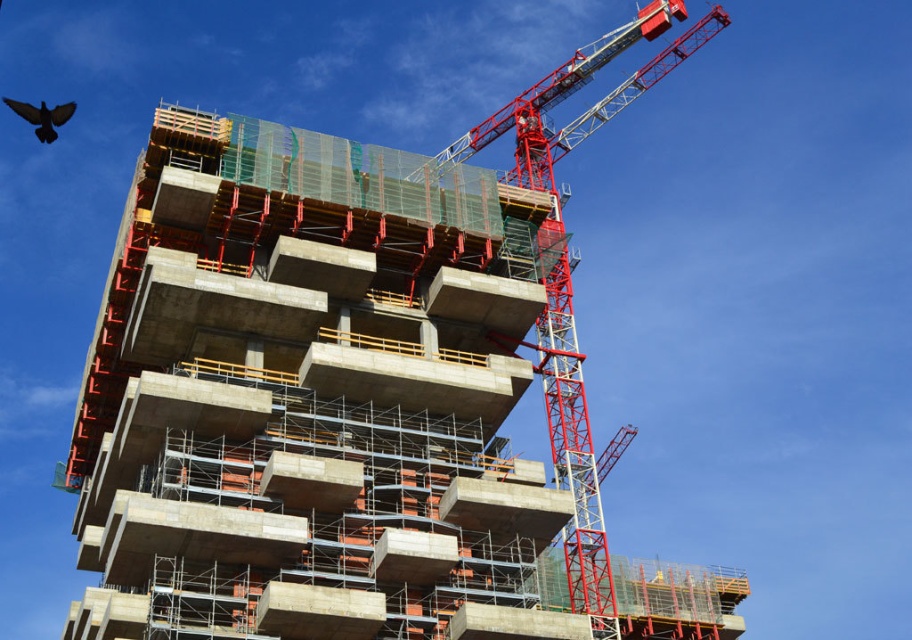
Question: Which of the following is the farthest from the observer?

Choices:
 (A) black feathered bird at upper left
 (B) concrete at center

Answer: (A)

Question: Considering the relative positions of concrete at center and black feathered bird at upper left in the image provided, where is concrete at center located with respect to black feathered bird at upper left?

Choices:
 (A) above
 (B) below

Answer: (B)

Question: Observing the image, what is the correct spatial positioning of metallic red crane at upper right in reference to black feathered bird at upper left?

Choices:
 (A) left
 (B) right

Answer: (B)

Question: Is concrete at center to the right of metallic red crane at upper right from the viewer's perspective?

Choices:
 (A) no
 (B) yes

Answer: (A)

Question: Which object is the farthest from the black feathered bird at upper left?

Choices:
 (A) metallic red crane at upper right
 (B) concrete at center

Answer: (B)

Question: Which object is the farthest from the concrete at center?

Choices:
 (A) black feathered bird at upper left
 (B) metallic red crane at upper right

Answer: (A)